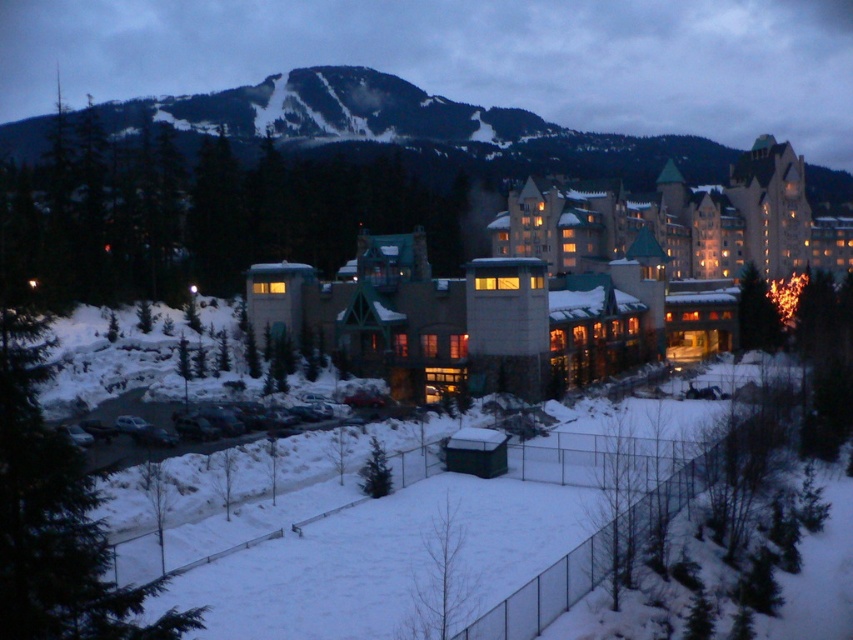
You are standing in the winter scene and want to walk from the white snow at lower center to the snowy forested mountain at upper center. Is the mountain higher than the snow area you are currently on?

The snowy forested mountain at upper center is above white snow at lower center, so yes, the mountain is higher than the snow area you are currently on.

You are standing at the base of the snowy forested mountain at upper center and want to walk to the white snow at lower center. Which direction should you head to reach your destination?

You should head downward towards the white snow at lower center because the snowy forested mountain at upper center is further away from you, meaning the white snow at lower center is closer and located below.